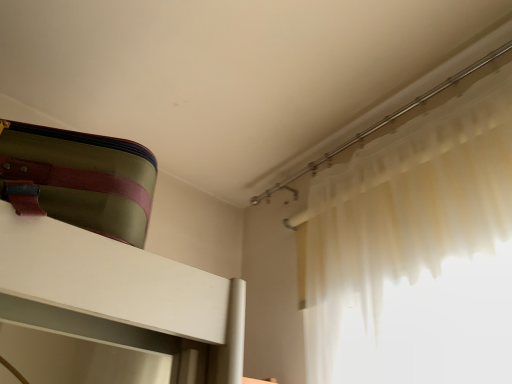
At what (x,y) coordinates should I click in order to perform the action: click on green matte suitcase at upper left. Please return your answer as a coordinate pair (x, y). The height and width of the screenshot is (384, 512). Looking at the image, I should click on (79, 179).

The height and width of the screenshot is (384, 512). Describe the element at coordinates (79, 179) in the screenshot. I see `green matte suitcase at upper left` at that location.

The image size is (512, 384). I want to click on green matte suitcase at upper left, so click(79, 179).